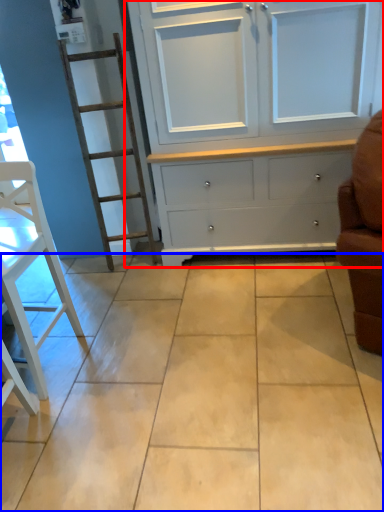
Question: Among these objects, which one is nearest to the camera, cupboard (highlighted by a red box) or ceramic tile (highlighted by a blue box)?

Choices:
 (A) cupboard
 (B) ceramic tile

Answer: (B)